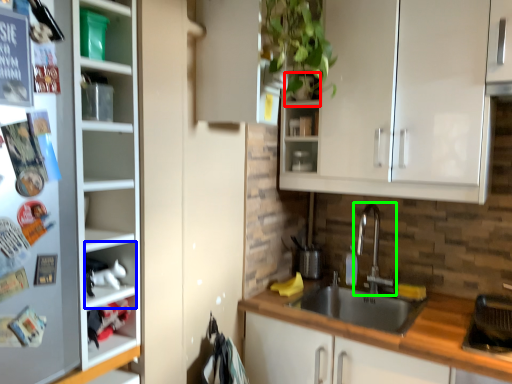
Question: Which object is the farthest from shelf (highlighted by a red box)? Choose among these: cabinet (highlighted by a blue box) or tap (highlighted by a green box).

Choices:
 (A) cabinet
 (B) tap

Answer: (A)